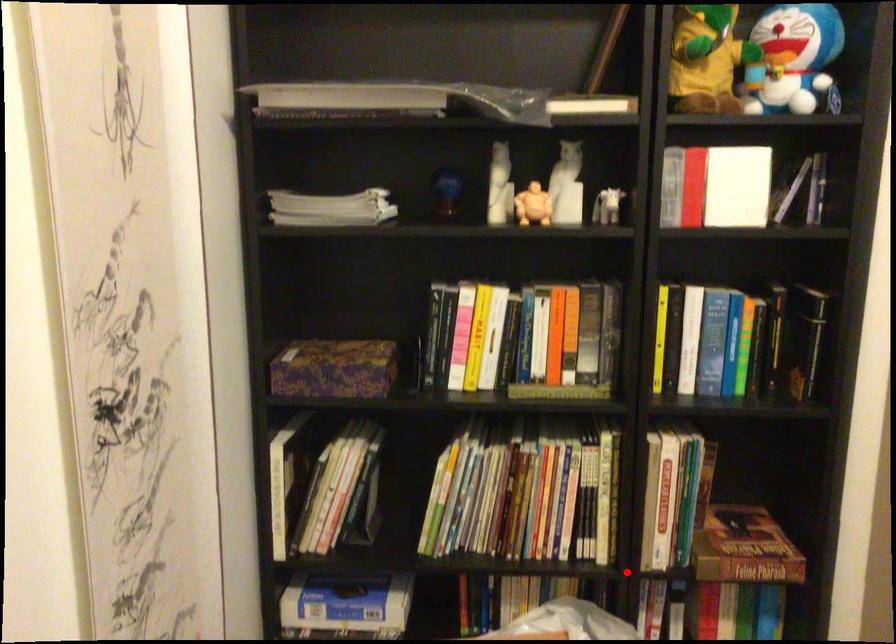
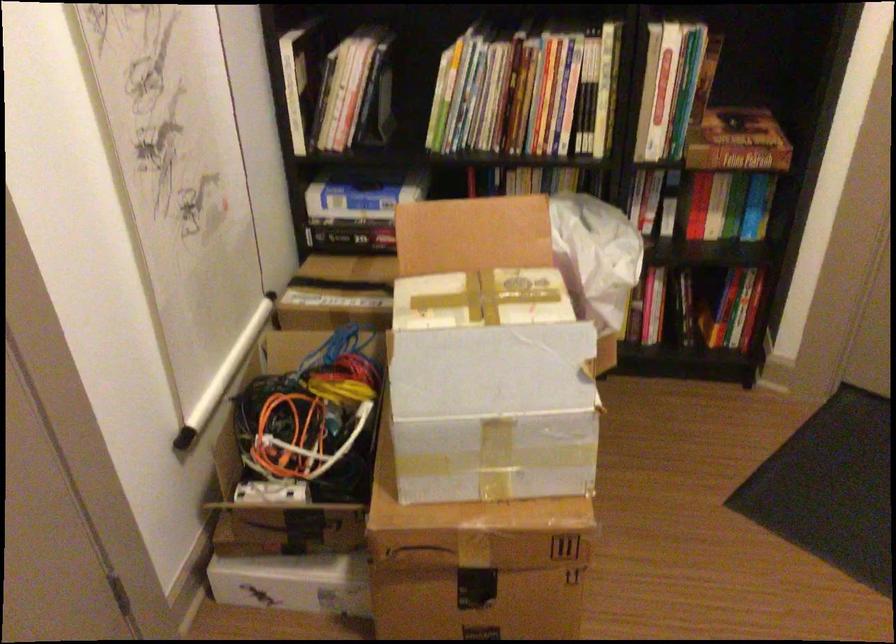
Find the pixel in the second image that matches the highlighted location in the first image.

(618, 161)